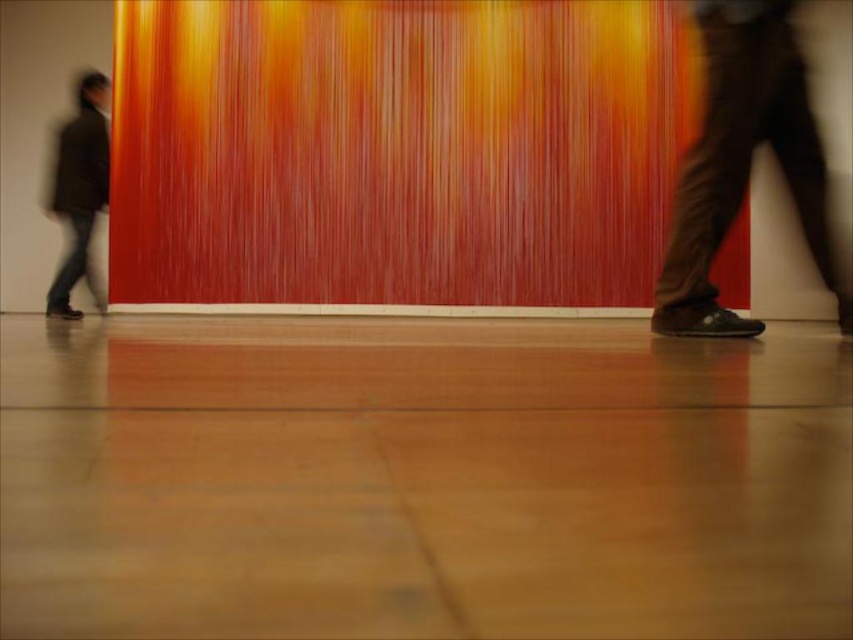
You are standing in the art gallery and want to determine the relative positions of two points marked in the image. Which point is closer to you, point (721, 131) or point (86, 90)?

Point (721, 131) is closer to the camera than point (86, 90).

You are standing in the art gallery and want to place a small sculpture exactly at the center of the floor. The floor is represented by coordinates from 0 to 1 on both axes. Given that the brown leather shoes at right are located at point 0.256, 0.872, can you determine if the sculpture will be placed closer to the wall or the entrance?

The sculpture is placed at the center of the floor, which is at point (426, 320). The brown leather shoes at right are at (743, 163). To determine proximity, calculate the distance from the sculpture to the wall and entrance. Assuming the wall is at y coordinate 1 and entrance at y coordinate 0, the distance to the wall is 0.5 units and to the entrance is 0.5 units. Thus, the sculpture is equidistant from both the wall and entrance.